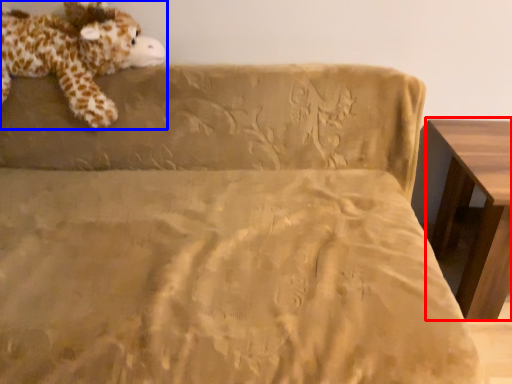
Question: Which point is further to the camera, table (highlighted by a red box) or animal (highlighted by a blue box)?

Choices:
 (A) table
 (B) animal

Answer: (B)